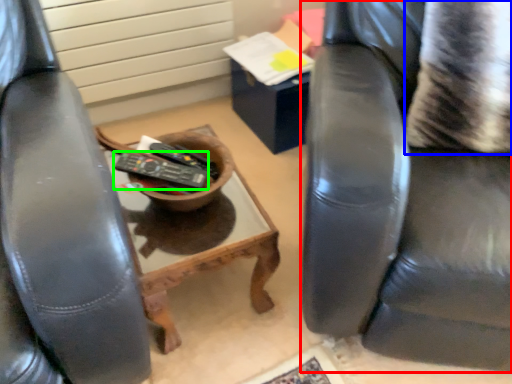
Question: Estimate the real-world distances between objects in this image. Which object is farther from chair (highlighted by a red box), pillow (highlighted by a blue box) or remote control (highlighted by a green box)?

Choices:
 (A) pillow
 (B) remote control

Answer: (B)